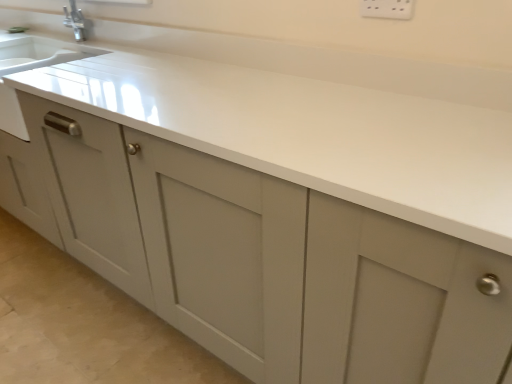
Question: From a real-world perspective, does white plastic electric outlet at upper center stand above white matte countertop at center?

Choices:
 (A) yes
 (B) no

Answer: (A)

Question: Can you confirm if white plastic electric outlet at upper center is shorter than white matte countertop at center?

Choices:
 (A) yes
 (B) no

Answer: (A)

Question: Can you confirm if white plastic electric outlet at upper center is taller than white matte countertop at center?

Choices:
 (A) yes
 (B) no

Answer: (B)

Question: Is white plastic electric outlet at upper center not near white matte countertop at center?

Choices:
 (A) no
 (B) yes

Answer: (A)

Question: Can you confirm if white plastic electric outlet at upper center is bigger than white matte countertop at center?

Choices:
 (A) yes
 (B) no

Answer: (B)

Question: Is the position of white plastic electric outlet at upper center more distant than that of white matte countertop at center?

Choices:
 (A) yes
 (B) no

Answer: (A)

Question: From a real-world perspective, does white matte countertop at center sit lower than white plastic electric outlet at upper center?

Choices:
 (A) yes
 (B) no

Answer: (A)

Question: Is white matte countertop at center at the left side of white plastic electric outlet at upper center?

Choices:
 (A) no
 (B) yes

Answer: (B)

Question: Does white matte countertop at center contain white plastic electric outlet at upper center?

Choices:
 (A) yes
 (B) no

Answer: (B)

Question: Is white plastic electric outlet at upper center at the back of white matte countertop at center?

Choices:
 (A) yes
 (B) no

Answer: (B)

Question: Is white matte countertop at center taller than white plastic electric outlet at upper center?

Choices:
 (A) yes
 (B) no

Answer: (A)

Question: From a real-world perspective, is white matte countertop at center physically above white plastic electric outlet at upper center?

Choices:
 (A) yes
 (B) no

Answer: (B)

Question: From the image's perspective, is white plastic electric outlet at upper center above or below white matte countertop at center?

Choices:
 (A) below
 (B) above

Answer: (B)